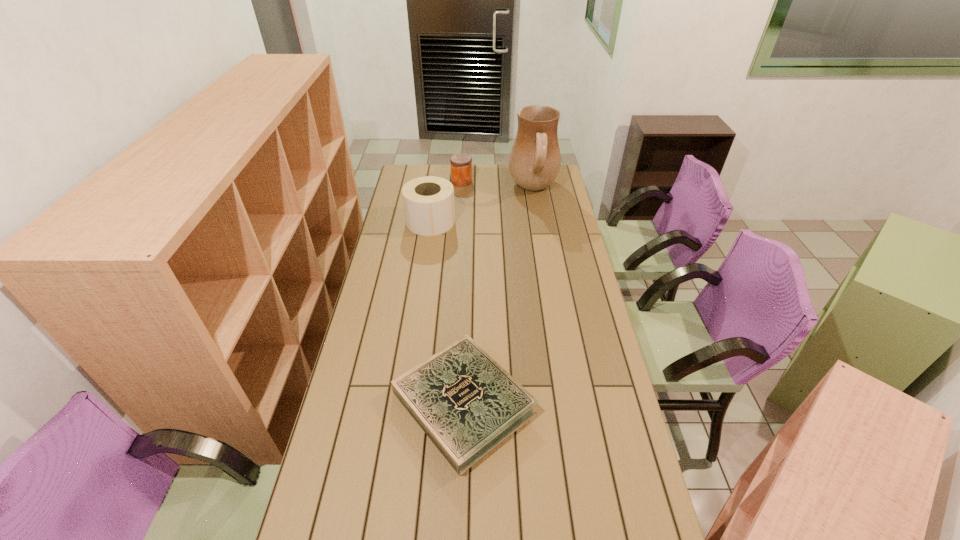
In order to click on vacant point located between the tallest object and the third shortest object in this screenshot , I will do `click(482, 206)`.

I want to click on vacant space that's between the shortest object and the second shortest object, so click(x=463, y=292).

I want to click on free space between the hardback book and the second shortest object, so click(x=463, y=292).

You are a GUI agent. You are given a task and a screenshot of the screen. Output one action in this format:
    pyautogui.click(x=<x>, y=<y>)
    Task: Click on the vacant area that lies between the toilet tissue and the nearest object
    
    Given the screenshot: What is the action you would take?
    pyautogui.click(x=447, y=312)

The width and height of the screenshot is (960, 540). In order to click on free point between the second shortest object and the tallest object in this screenshot , I will do `click(497, 185)`.

What are the coordinates of `vacant space that's between the tallest object and the jar` in the screenshot? It's located at (497, 185).

Find the location of a particular element. unoccupied area between the toilet tissue and the tallest object is located at coordinates (482, 206).

Locate an element on the screen. Image resolution: width=960 pixels, height=540 pixels. free space that is in between the second tallest object and the cream pitcher is located at coordinates (482, 206).

Identify which object is the nearest to the second tallest object. Please provide its 2D coordinates. Your answer should be formatted as a tuple, i.e. [(x, y)], where the tuple contains the x and y coordinates of a point satisfying the conditions above.

[(461, 164)]

The image size is (960, 540). Identify the location of the closest object to the hardback book. (428, 201).